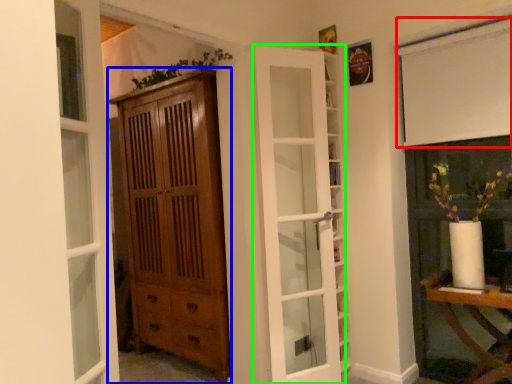
Question: Considering the real-world distances, which object is closest to curtain (highlighted by a red box)? cabinetry (highlighted by a blue box) or door (highlighted by a green box).

Choices:
 (A) cabinetry
 (B) door

Answer: (B)